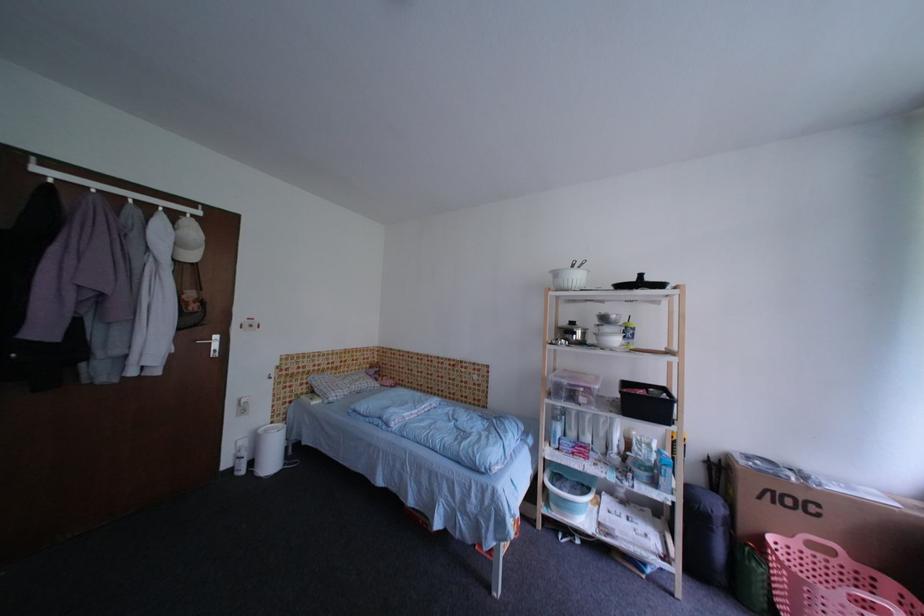
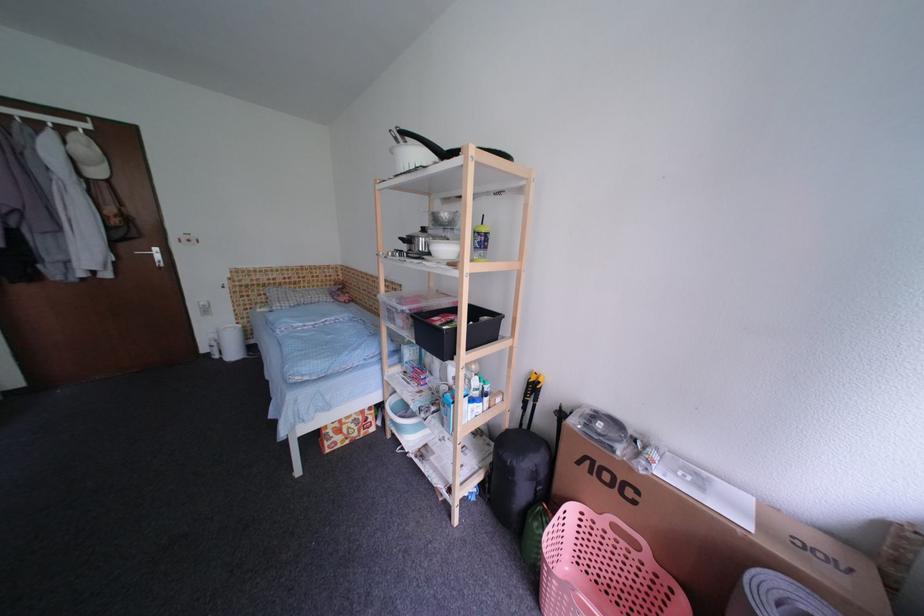
The point at (252, 445) is marked in the first image. Where is the corresponding point in the second image?

(222, 338)